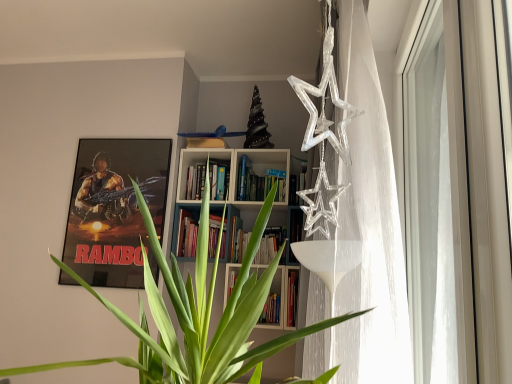
Identify the location of vacant region above metallic poster at upper left (from a real-world perspective). The width and height of the screenshot is (512, 384). (122, 132).